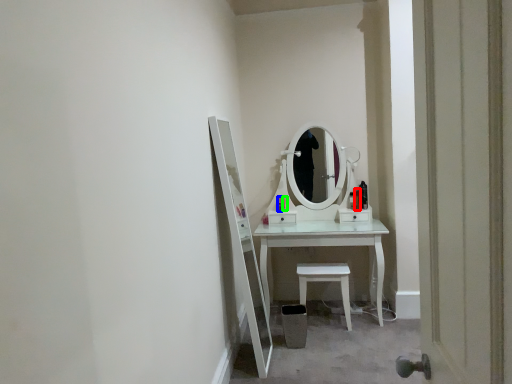
Question: Based on their relative distances, which object is farther from toiletry (highlighted by a red box)? Choose from toiletry (highlighted by a blue box) and toiletry (highlighted by a green box).

Choices:
 (A) toiletry
 (B) toiletry

Answer: (A)